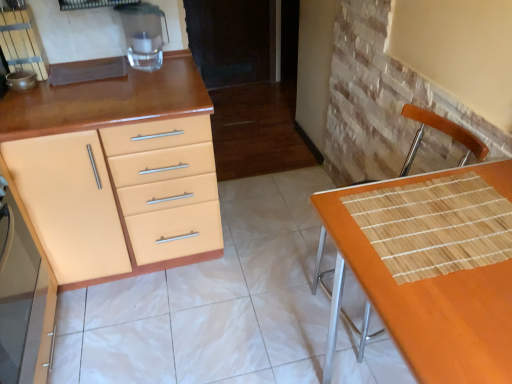
What are the coordinates of `free location in front of transparent glass water at upper left` in the screenshot? It's located at (151, 86).